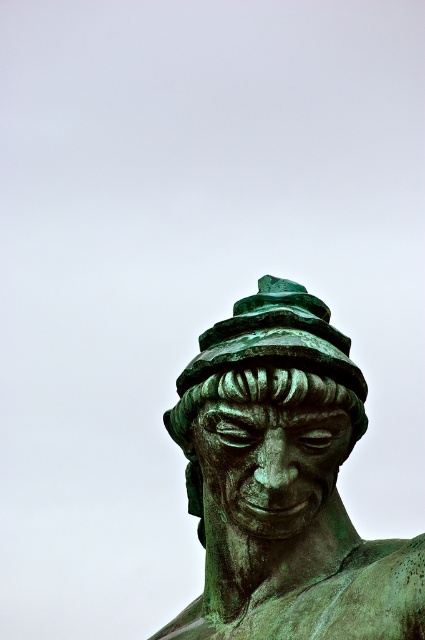
Question: Which point is farther to the camera?

Choices:
 (A) green patina hat at center
 (B) green patina statue at center

Answer: (A)

Question: Can you confirm if green patina statue at center is smaller than green patina hat at center?

Choices:
 (A) yes
 (B) no

Answer: (B)

Question: Does green patina statue at center appear on the left side of green patina hat at center?

Choices:
 (A) no
 (B) yes

Answer: (B)

Question: Which object appears farthest from the camera in this image?

Choices:
 (A) green patina hat at center
 (B) green patina statue at center

Answer: (A)

Question: Can you confirm if green patina statue at center is smaller than green patina hat at center?

Choices:
 (A) yes
 (B) no

Answer: (B)